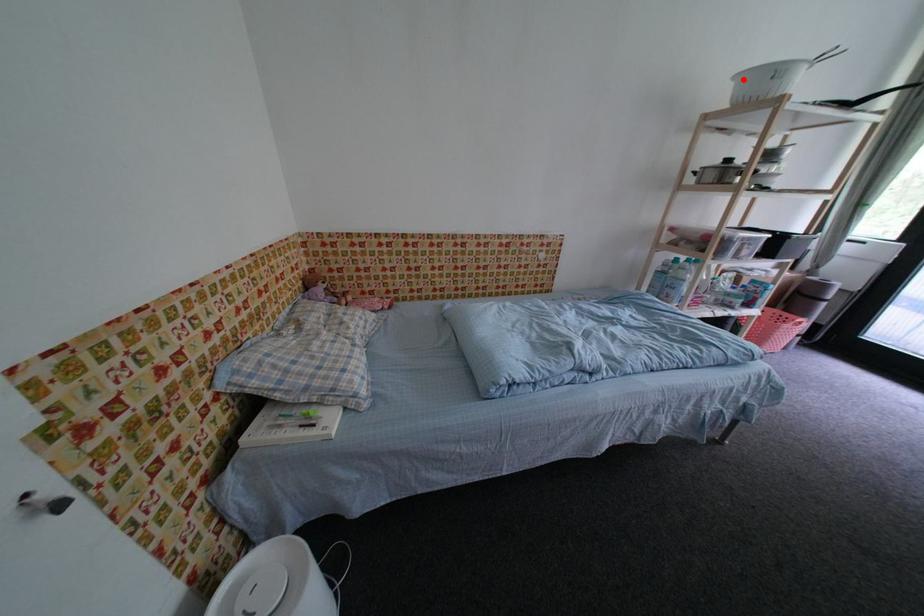
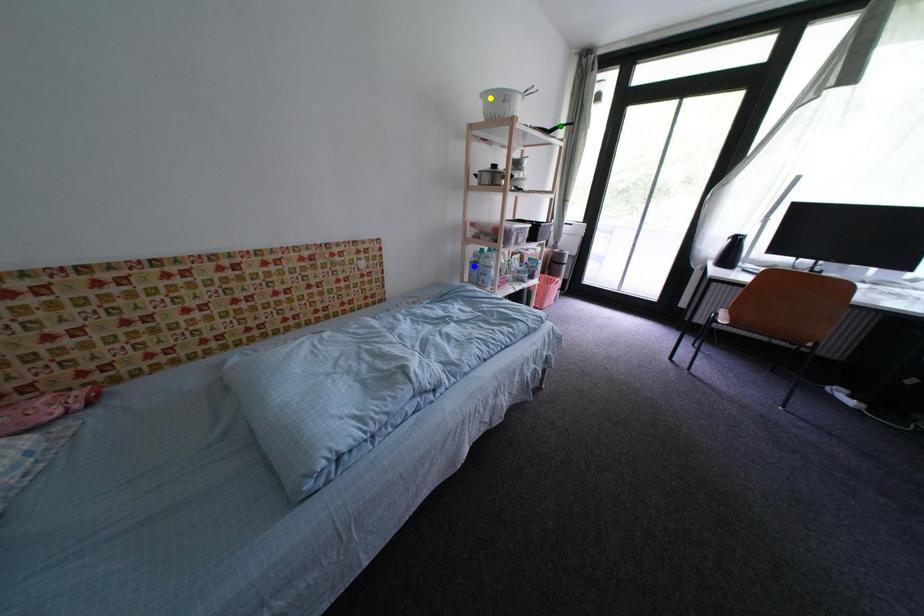
Question: I am providing you with two images of the same scene from different viewpoints. A red point is marked on the first image. You are given multiple points on the second image. In image 2, which mark is for the same physical point as the one in image 1?

Choices:
 (A) green point
 (B) yellow point
 (C) blue point

Answer: (B)